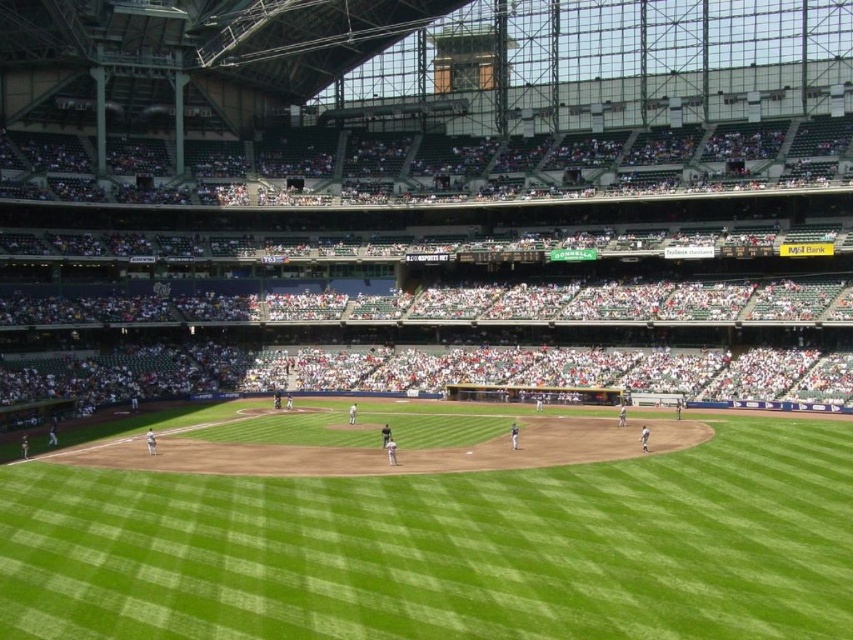
Question: Can you confirm if white plastic seats at upper center is thinner than green grass field at center?

Choices:
 (A) no
 (B) yes

Answer: (A)

Question: Which of the following is the closest to the observer?

Choices:
 (A) white plastic seats at upper center
 (B) green grass field at center

Answer: (B)

Question: Which point is farther from the camera taking this photo?

Choices:
 (A) (825, 632)
 (B) (131, 275)

Answer: (B)

Question: Can you confirm if white plastic seats at upper center is smaller than green grass field at center?

Choices:
 (A) yes
 (B) no

Answer: (B)

Question: Which point is farther to the camera?

Choices:
 (A) white plastic seats at upper center
 (B) green grass field at center

Answer: (A)

Question: Can you confirm if white plastic seats at upper center is positioned below green grass field at center?

Choices:
 (A) yes
 (B) no

Answer: (B)